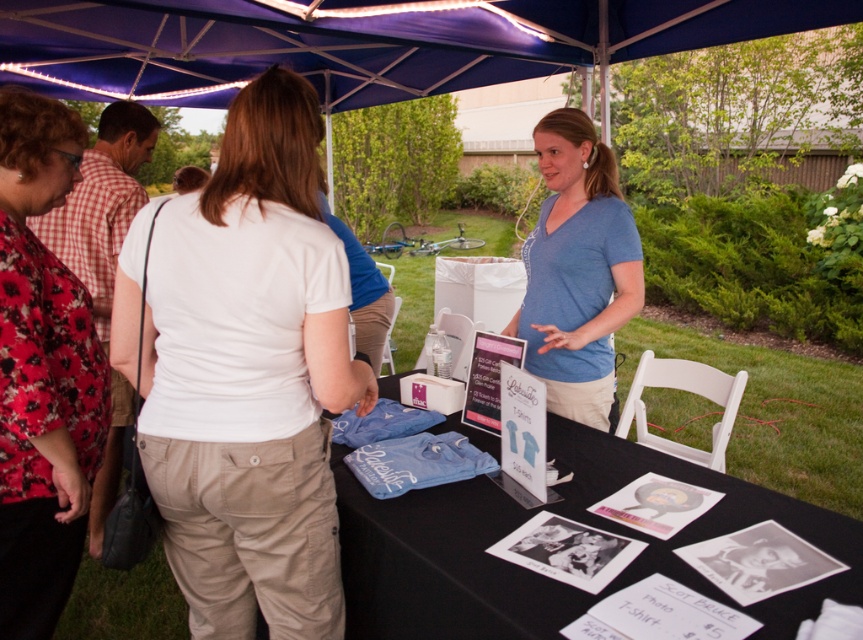
You are standing at the point closest to the table in the image. Which of the two points, point (591,481) or point (4,300), is farther away from you?

Point (591,481) is farther away from you because it is behind point (4,300), which is closer to you.

You are setting up a booth at the Lakeside TShirt event and need to place a new sign between the white cotton shirt at center and the floral print blouse at upper left. The sign is 20 centimeters wide. Will there be enough space between them to fit the sign?

The distance between the white cotton shirt at center and the floral print blouse at upper left is 38.00 centimeters. Since the sign is only 20 centimeters wide, there will be enough space to fit it between them.

You are at a community fair and want to buy a souvenir. You see the blue fabric canopy at upper center and the blue fabric table at center. Which one is bigger in size?

The blue fabric canopy at upper center has a larger size compared to the blue fabric table at center, so the blue fabric canopy at upper center is bigger.